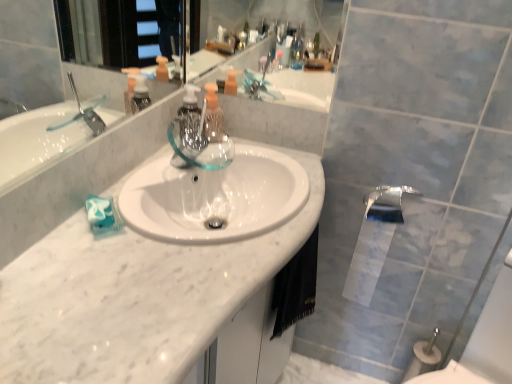
Question: Would you say white glossy toilet paper at lower right is outside translucent plastic soap dispenser at center?

Choices:
 (A) yes
 (B) no

Answer: (A)

Question: Does white glossy toilet paper at lower right have a smaller size compared to translucent plastic soap dispenser at center?

Choices:
 (A) no
 (B) yes

Answer: (A)

Question: Are white glossy toilet paper at lower right and translucent plastic soap dispenser at center far apart?

Choices:
 (A) no
 (B) yes

Answer: (A)

Question: Considering the relative sizes of white glossy toilet paper at lower right and translucent plastic soap dispenser at center in the image provided, is white glossy toilet paper at lower right wider than translucent plastic soap dispenser at center?

Choices:
 (A) yes
 (B) no

Answer: (A)

Question: From a real-world perspective, is white glossy toilet paper at lower right physically below translucent plastic soap dispenser at center?

Choices:
 (A) yes
 (B) no

Answer: (A)

Question: Is point (357, 261) positioned closer to the camera than point (102, 352)?

Choices:
 (A) farther
 (B) closer

Answer: (A)

Question: Considering the positions of white glossy toilet paper at lower right and white marble counter top at center in the image, is white glossy toilet paper at lower right wider or thinner than white marble counter top at center?

Choices:
 (A) thin
 (B) wide

Answer: (A)

Question: Is white glossy toilet paper at lower right in front of or behind white marble counter top at center in the image?

Choices:
 (A) behind
 (B) front

Answer: (A)

Question: In the image, is white glossy toilet paper at lower right on the left side or the right side of white marble counter top at center?

Choices:
 (A) right
 (B) left

Answer: (A)

Question: In the image, is white glossy toilet paper at lower right on the left side or the right side of translucent plastic soap dispenser at center?

Choices:
 (A) left
 (B) right

Answer: (B)

Question: Is white glossy toilet paper at lower right inside the boundaries of translucent plastic soap dispenser at center, or outside?

Choices:
 (A) outside
 (B) inside

Answer: (A)

Question: From the image's perspective, is white glossy toilet paper at lower right positioned above or below translucent plastic soap dispenser at center?

Choices:
 (A) above
 (B) below

Answer: (B)

Question: Is white glossy toilet paper at lower right taller or shorter than translucent plastic soap dispenser at center?

Choices:
 (A) short
 (B) tall

Answer: (B)

Question: Would you say translucent plastic soap dispenser at center is to the left or to the right of black fabric hand towel at lower center in the picture?

Choices:
 (A) right
 (B) left

Answer: (B)

Question: From a real-world perspective, relative to black fabric hand towel at lower center, is translucent plastic soap dispenser at center vertically above or below?

Choices:
 (A) above
 (B) below

Answer: (A)